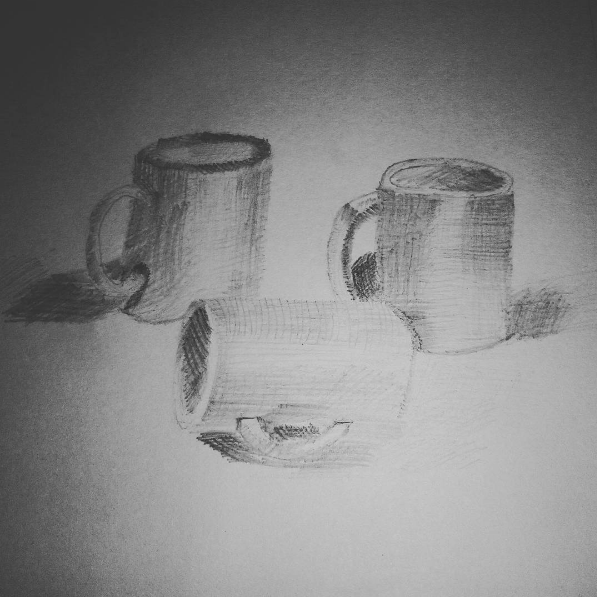
Identify the location of standing cups. (207, 224), (440, 238).